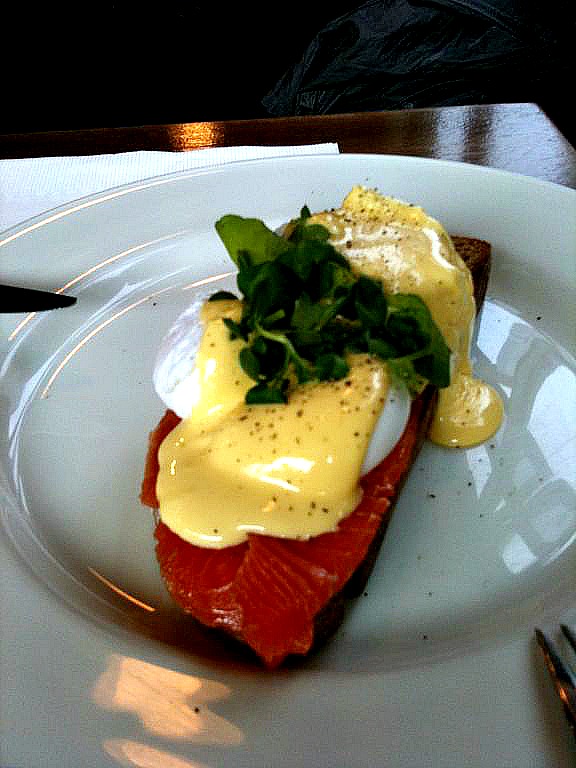
Where is `napkin`? The width and height of the screenshot is (576, 768). napkin is located at coordinates (72, 180).